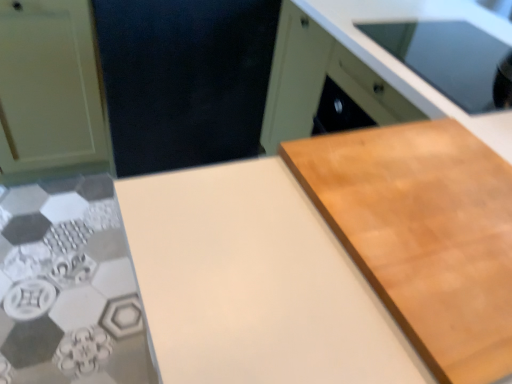
Question: Considering the relative sizes of matte white cabinet at left, which is the first cabinetry from left to right, and light brown wood cutting board at right in the image provided, is matte white cabinet at left, which is the first cabinetry from left to right, bigger than light brown wood cutting board at right?

Choices:
 (A) yes
 (B) no

Answer: (A)

Question: From a real-world perspective, is matte white cabinet at left, which is the first cabinetry from left to right, over light brown wood cutting board at right?

Choices:
 (A) yes
 (B) no

Answer: (B)

Question: From the image's perspective, does matte white cabinet at left, the second cabinetry positioned from the right, appear lower than light brown wood cutting board at right?

Choices:
 (A) no
 (B) yes

Answer: (A)

Question: Is matte white cabinet at left, the second cabinetry positioned from the right, thinner than light brown wood cutting board at right?

Choices:
 (A) no
 (B) yes

Answer: (A)

Question: Is matte white cabinet at left, which is the first cabinetry from left to right, closer to the viewer compared to light brown wood cutting board at right?

Choices:
 (A) no
 (B) yes

Answer: (A)

Question: In the image, is light brown wood cutting board at right on the left side or the right side of light wood cabinet at upper right, which is the 1th cabinetry in right-to-left order?

Choices:
 (A) left
 (B) right

Answer: (A)

Question: From a real-world perspective, is light brown wood cutting board at right above or below light wood cabinet at upper right, which is counted as the second cabinetry, starting from the left?

Choices:
 (A) above
 (B) below

Answer: (A)

Question: Is light brown wood cutting board at right situated inside light wood cabinet at upper right, which is counted as the second cabinetry, starting from the left, or outside?

Choices:
 (A) outside
 (B) inside

Answer: (A)

Question: From the image's perspective, is light brown wood cutting board at right located above or below light wood cabinet at upper right, which is the 1th cabinetry in right-to-left order?

Choices:
 (A) above
 (B) below

Answer: (B)

Question: Considering the positions of matte white cabinet at left, which is the first cabinetry from left to right, and white matte countertop at center in the image, is matte white cabinet at left, which is the first cabinetry from left to right, taller or shorter than white matte countertop at center?

Choices:
 (A) tall
 (B) short

Answer: (B)

Question: Is matte white cabinet at left, which is the first cabinetry from left to right, wider or thinner than white matte countertop at center?

Choices:
 (A) wide
 (B) thin

Answer: (A)

Question: From a real-world perspective, is matte white cabinet at left, the second cabinetry positioned from the right, above or below white matte countertop at center?

Choices:
 (A) above
 (B) below

Answer: (B)

Question: Is matte white cabinet at left, the second cabinetry positioned from the right, bigger or smaller than white matte countertop at center?

Choices:
 (A) big
 (B) small

Answer: (B)

Question: From the image's perspective, relative to light wood cabinet at upper right, which is the 1th cabinetry in right-to-left order, is white matte countertop at center above or below?

Choices:
 (A) above
 (B) below

Answer: (B)

Question: In terms of width, does white matte countertop at center look wider or thinner when compared to light wood cabinet at upper right, which is counted as the second cabinetry, starting from the left?

Choices:
 (A) thin
 (B) wide

Answer: (A)